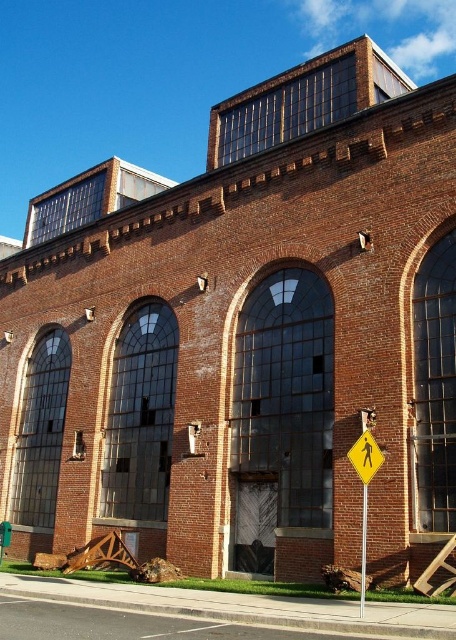
From the picture: Is yellow reflective plastic pedestrian crossing sign at lower right wider than metallic pole at right?

Incorrect, yellow reflective plastic pedestrian crossing sign at lower right's width does not surpass metallic pole at right's.

Can you confirm if yellow reflective plastic pedestrian crossing sign at lower right is thinner than metallic pole at right?

Yes, yellow reflective plastic pedestrian crossing sign at lower right is thinner than metallic pole at right.

Does point (367, 438) come in front of point (362, 602)?

No, (367, 438) is further to viewer.

Find the location of a particular element. Image resolution: width=456 pixels, height=640 pixels. yellow reflective plastic pedestrian crossing sign at lower right is located at coordinates (366, 456).